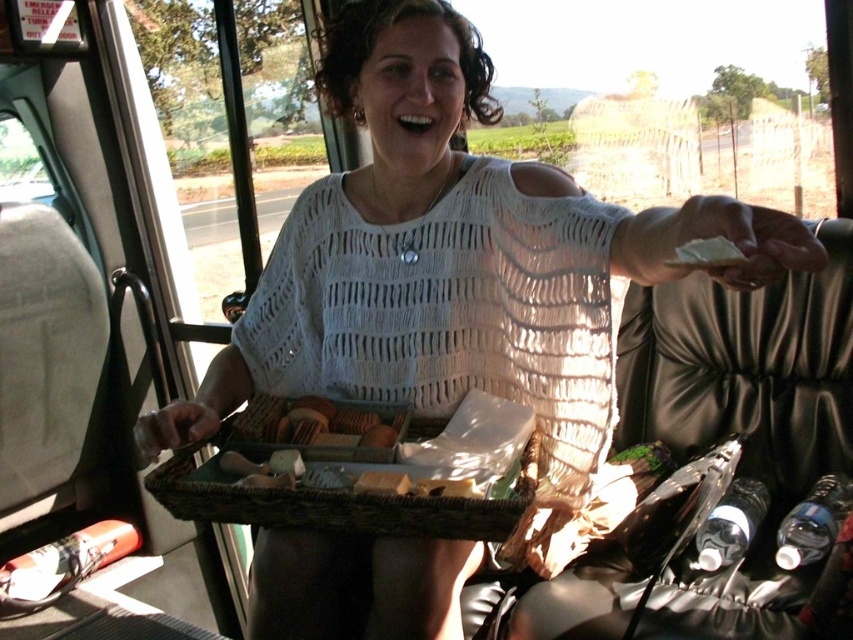
Between woven brown basket at center and white matte bread at upper right, which one is positioned lower?

woven brown basket at center is lower down.

This screenshot has width=853, height=640. Find the location of `woven brown basket at center`. woven brown basket at center is located at coordinates (321, 502).